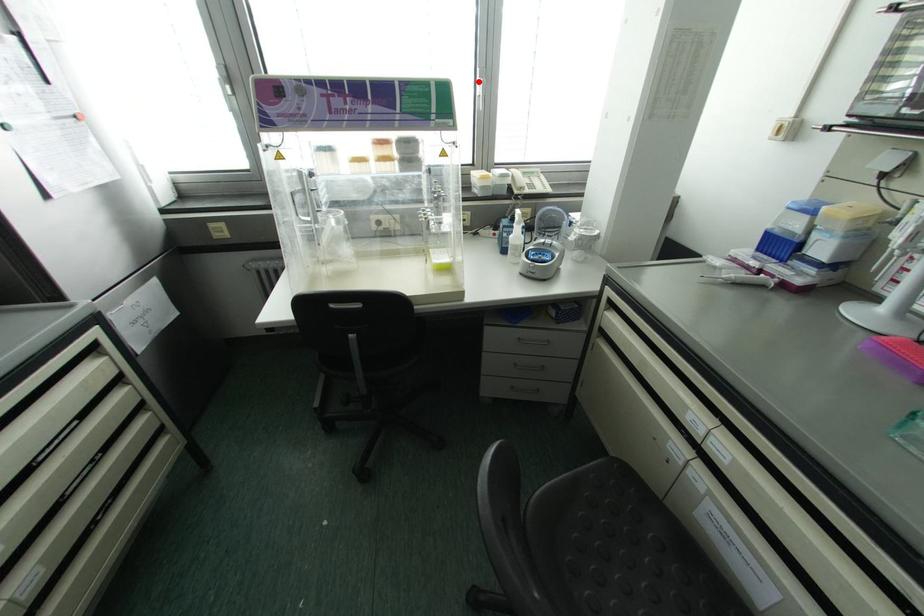
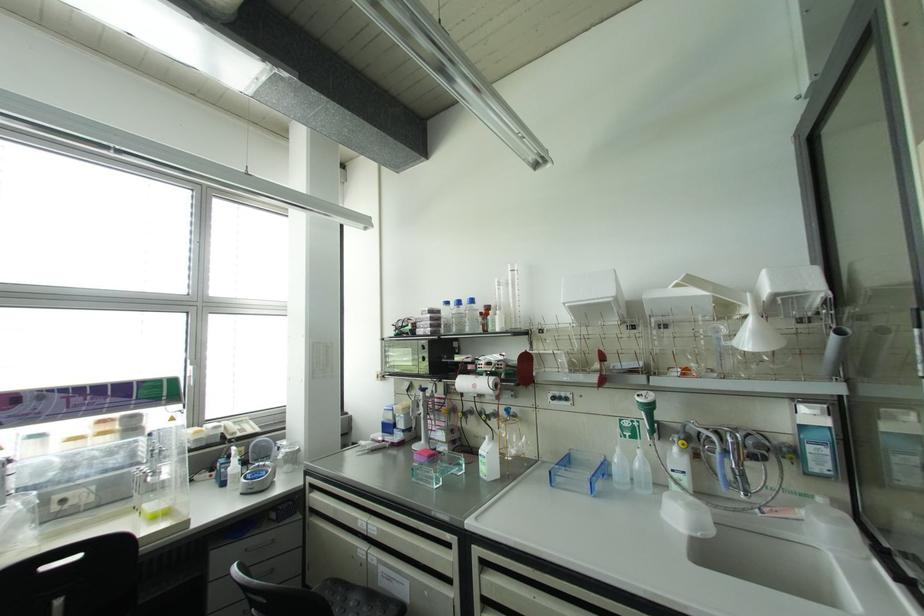
Locate, in the second image, the point that corresponds to the highlighted location in the first image.

(189, 368)